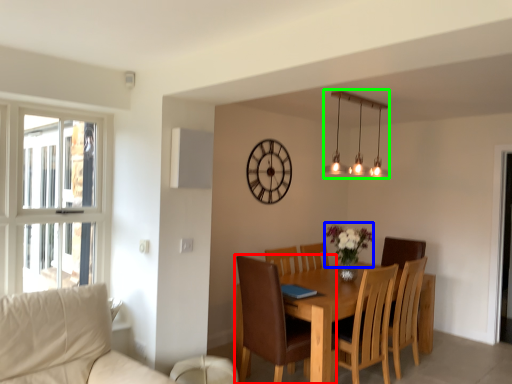
Question: Estimate the real-world distances between objects in this image. Which object is farther from chair (highlighted by a red box), flower (highlighted by a blue box) or lamp (highlighted by a green box)?

Choices:
 (A) flower
 (B) lamp

Answer: (B)